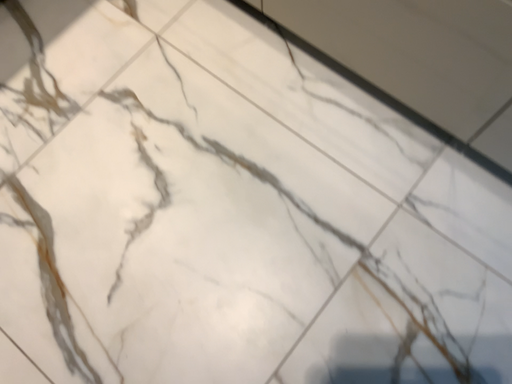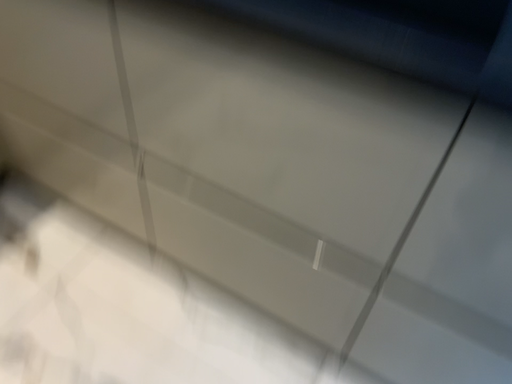
Question: Which way did the camera rotate in the video?

Choices:
 (A) rotated upward
 (B) rotated downward

Answer: (A)